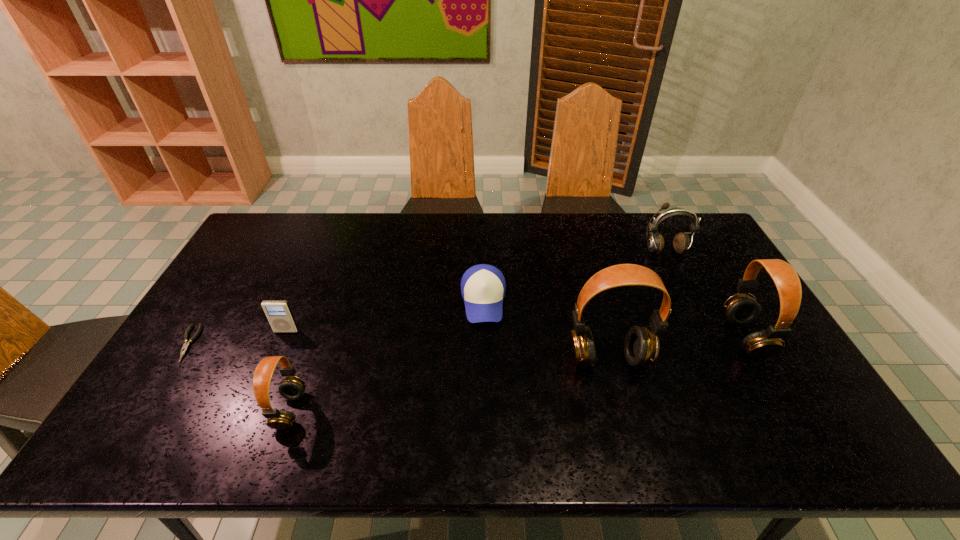
You are a GUI agent. You are given a task and a screenshot of the screen. Output one action in this format:
    pyautogui.click(x=<x>, y=<y>)
    Task: Click on the baseball cap
    The width and height of the screenshot is (960, 540).
    Given the screenshot: What is the action you would take?
    pyautogui.click(x=483, y=286)

Where is `the fourth object from left to right`? the fourth object from left to right is located at coordinates (483, 286).

What are the coordinates of `vacant space situated 0.070m on the ear cups of the shortest headset` in the screenshot? It's located at (331, 410).

Find the location of a particular element. free space located on the ear cups of the second headset from right to left is located at coordinates pos(618,395).

Locate an element on the screen. vacant area located on the ear pads of the earphone is located at coordinates (680, 282).

Image resolution: width=960 pixels, height=540 pixels. Find the location of `free region located on the front-facing side of the fifth tallest object`. free region located on the front-facing side of the fifth tallest object is located at coordinates (253, 408).

The image size is (960, 540). Find the location of `vacant area situated 0.060m on the back of the shortest object`. vacant area situated 0.060m on the back of the shortest object is located at coordinates (208, 310).

The width and height of the screenshot is (960, 540). In order to click on free space located on the front-facing side of the second shortest object in this screenshot , I will do `click(484, 393)`.

You are a GUI agent. You are given a task and a screenshot of the screen. Output one action in this format:
    pyautogui.click(x=<x>, y=<y>)
    Task: Click on the object at the far edge
    The width and height of the screenshot is (960, 540).
    Given the screenshot: What is the action you would take?
    pyautogui.click(x=681, y=243)

This screenshot has height=540, width=960. I want to click on object at the near edge, so coord(292,387).